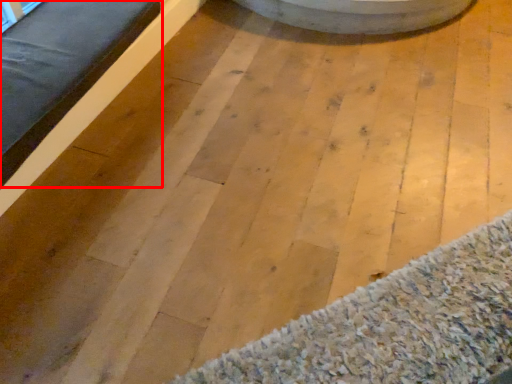
Question: Where is furniture (annotated by the red box) located in relation to mat in the image?

Choices:
 (A) right
 (B) left

Answer: (B)